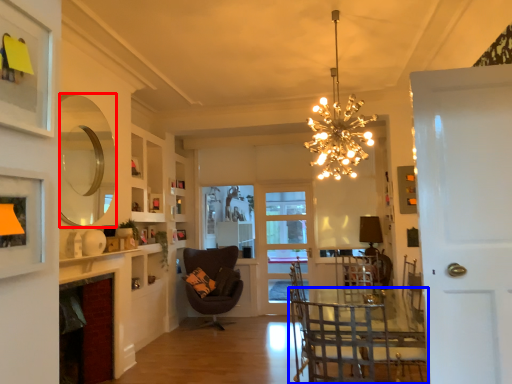
Question: Which of the following is the farthest to the observer, mirror (highlighted by a red box) or chair (highlighted by a blue box)?

Choices:
 (A) mirror
 (B) chair

Answer: (A)